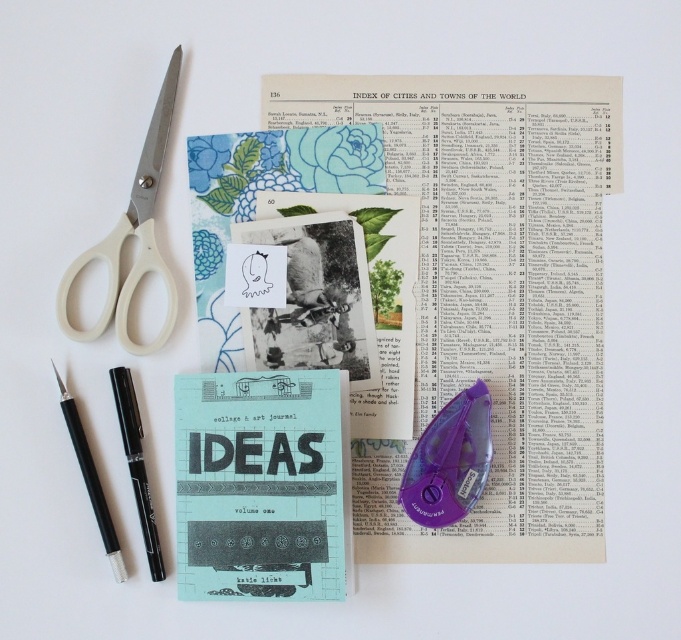
Looking at this image, who is shorter, matte blue paper at center or black plastic pen at lower left?

Standing shorter between the two is black plastic pen at lower left.

Can you confirm if matte blue paper at center is taller than black plastic pen at lower left?

Correct, matte blue paper at center is much taller as black plastic pen at lower left.

This screenshot has height=640, width=681. I want to click on matte blue paper at center, so click(x=262, y=484).

In order to click on matte blue paper at center in this screenshot , I will do `click(262, 484)`.

Is matte blue paper at center to the right of black matte pen at lower left from the viewer's perspective?

Indeed, matte blue paper at center is positioned on the right side of black matte pen at lower left.

Between matte blue paper at center and black matte pen at lower left, which one is positioned higher?

black matte pen at lower left

Who is more distant from viewer, (x=313, y=392) or (x=125, y=451)?

The point (x=125, y=451) is more distant.

What are the coordinates of `matte blue paper at center` in the screenshot? It's located at (262, 484).

Between purple plastic tape dispenser at center-right and black matte pen at lower left, which one has less height?

purple plastic tape dispenser at center-right is shorter.

Which is more to the right, purple plastic tape dispenser at center-right or black matte pen at lower left?

purple plastic tape dispenser at center-right is more to the right.

The image size is (681, 640). Identify the location of purple plastic tape dispenser at center-right. (449, 460).